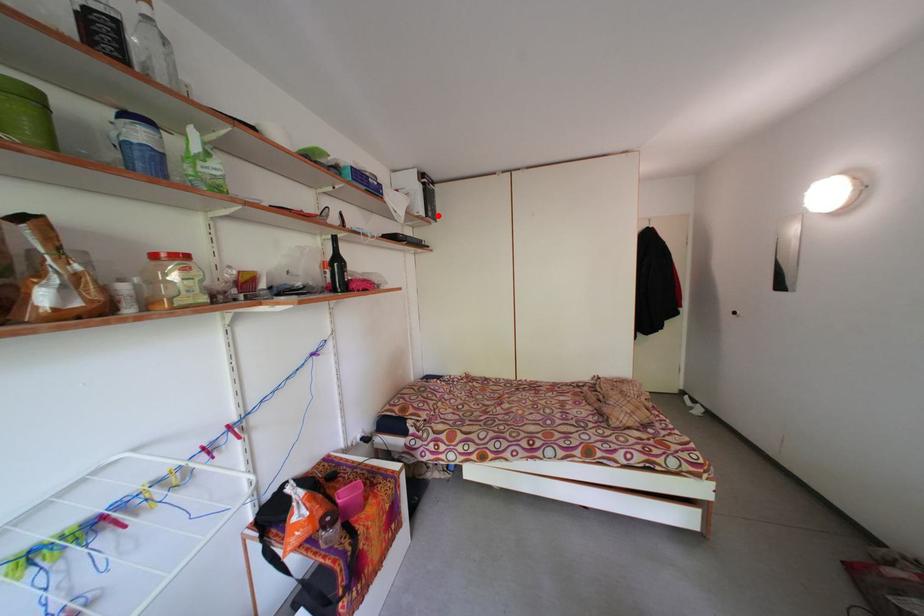
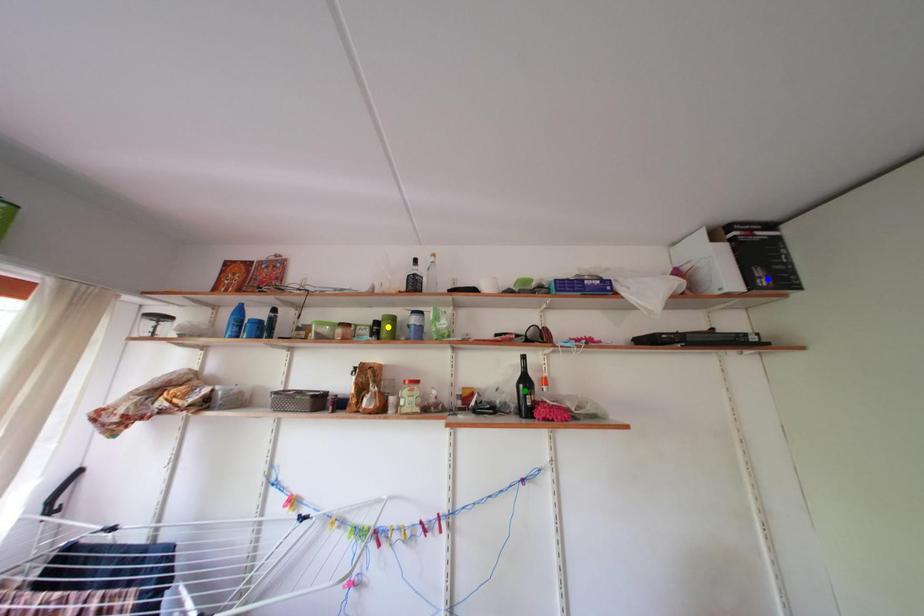
Question: I am providing you with two images of the same scene from different viewpoints. A red point is marked on the first image. You are given multiple points on the second image. In image 2, which mark is for the same physical point as the one in image 1?

Choices:
 (A) blue point
 (B) yellow point
 (C) green point

Answer: (A)